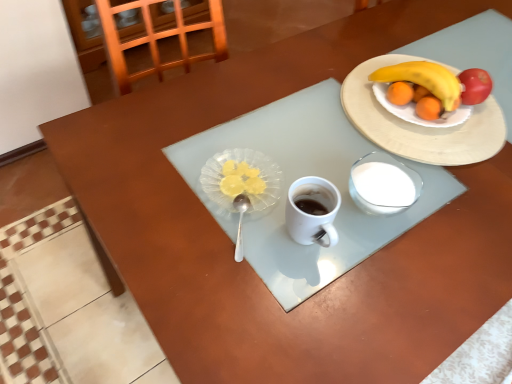
The height and width of the screenshot is (384, 512). I want to click on vacant space situated on the left part of silver metallic spoon at center, so click(160, 206).